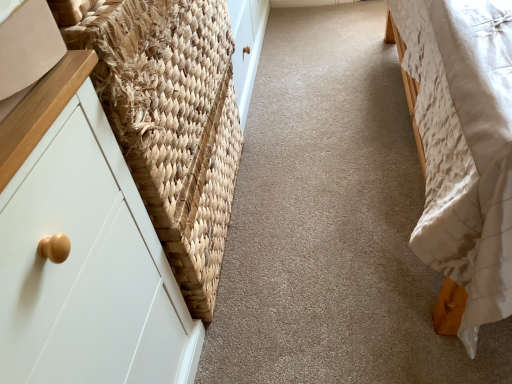
Describe the element at coordinates (462, 145) in the screenshot. This screenshot has height=384, width=512. I see `white quilted fabric bed at right` at that location.

Where is `white quilted fabric bed at right`? The height and width of the screenshot is (384, 512). white quilted fabric bed at right is located at coordinates (462, 145).

What is the approximate height of white quilted fabric bed at right?

18.63 inches.

Image resolution: width=512 pixels, height=384 pixels. What do you see at coordinates (172, 122) in the screenshot? I see `natural woven basket at left` at bounding box center [172, 122].

The width and height of the screenshot is (512, 384). Identify the location of natural woven basket at left. (172, 122).

Locate an element on the screen. Image resolution: width=512 pixels, height=384 pixels. white quilted fabric bed at right is located at coordinates (462, 145).

Can you confirm if white quilted fabric bed at right is positioned to the left of natural woven basket at left?

In fact, white quilted fabric bed at right is to the right of natural woven basket at left.

Does white quilted fabric bed at right come in front of natural woven basket at left?

Yes, it is.

Is point (509, 232) closer or farther from the camera than point (183, 34)?

Point (509, 232) appears to be closer to the viewer than point (183, 34).

From the image's perspective, which one is positioned lower, white quilted fabric bed at right or natural woven basket at left?

natural woven basket at left is shown below in the image.

From a real-world perspective, is white quilted fabric bed at right positioned above or below natural woven basket at left?

white quilted fabric bed at right is situated lower than natural woven basket at left in the real world.

Considering the sizes of white quilted fabric bed at right and natural woven basket at left in the image, is white quilted fabric bed at right wider or thinner than natural woven basket at left?

white quilted fabric bed at right is wider than natural woven basket at left.

Is white quilted fabric bed at right shorter than natural woven basket at left?

No, white quilted fabric bed at right is not shorter than natural woven basket at left.

Who is bigger, white quilted fabric bed at right or natural woven basket at left?

white quilted fabric bed at right is bigger.

Looking at this image, choose the correct answer: Is white quilted fabric bed at right inside natural woven basket at left or outside it?

white quilted fabric bed at right is located beyond the bounds of natural woven basket at left.

Is white quilted fabric bed at right beside natural woven basket at left?

No, white quilted fabric bed at right is not next to natural woven basket at left.

Is natural woven basket at left at the back of white quilted fabric bed at right?

No, white quilted fabric bed at right is not facing away from natural woven basket at left.

Find the location of a particular element. Image resolution: width=512 pixels, height=384 pixels. furniture directly beneath the natural woven basket at left (from a real-world perspective) is located at coordinates coord(462,145).

Does natural woven basket at left appear on the right side of white quilted fabric bed at right?

In fact, natural woven basket at left is to the left of white quilted fabric bed at right.

Is natural woven basket at left in front of or behind white quilted fabric bed at right in the image?

Visually, natural woven basket at left is located behind white quilted fabric bed at right.

Is point (160, 206) closer or farther from the camera than point (430, 210)?

Point (160, 206) is positioned closer to the camera compared to point (430, 210).

From the image's perspective, is natural woven basket at left located above or below white quilted fabric bed at right?

natural woven basket at left is situated lower than white quilted fabric bed at right in the image.

From a real-world perspective, between natural woven basket at left and white quilted fabric bed at right, who is vertically higher?

natural woven basket at left.

Consider the image. Considering the sizes of objects natural woven basket at left and white quilted fabric bed at right in the image provided, who is wider, natural woven basket at left or white quilted fabric bed at right?

white quilted fabric bed at right.

Does natural woven basket at left have a lesser height compared to white quilted fabric bed at right?

Indeed, natural woven basket at left has a lesser height compared to white quilted fabric bed at right.

From the picture: Which of these two, natural woven basket at left or white quilted fabric bed at right, is smaller?

natural woven basket at left is smaller.

Is white quilted fabric bed at right a part of natural woven basket at left?

No, white quilted fabric bed at right is not inside natural woven basket at left.

Is natural woven basket at left far from white quilted fabric bed at right?

No, natural woven basket at left is in close proximity to white quilted fabric bed at right.

Is natural woven basket at left looking in the opposite direction of white quilted fabric bed at right?

That's not correct — natural woven basket at left is not looking away from white quilted fabric bed at right.

Find the location of a particular element. furniture in front of the natural woven basket at left is located at coordinates (462, 145).

Where is `basket on the left of white quilted fabric bed at right`? The width and height of the screenshot is (512, 384). basket on the left of white quilted fabric bed at right is located at coordinates (172, 122).

Find the location of a particular element. furniture in front of the natural woven basket at left is located at coordinates coord(462,145).